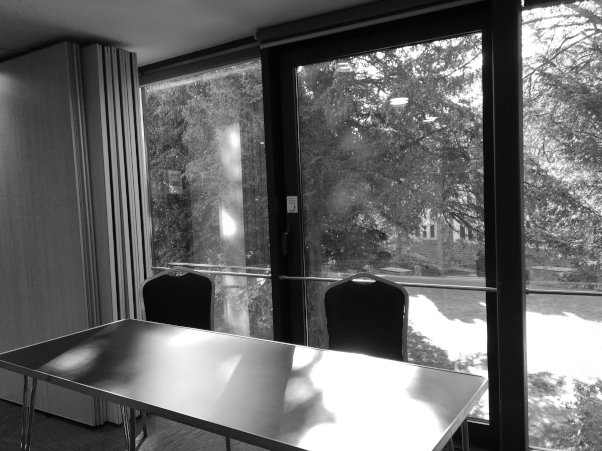
Find the location of `ceiling`. ceiling is located at coordinates (17, 12), (17, 376).